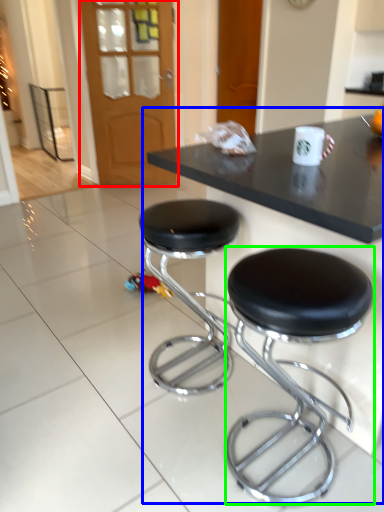
Question: Estimate the real-world distances between objects in this image. Which object is closer to glass door (highlighted by a red box), table (highlighted by a blue box) or stool (highlighted by a green box)?

Choices:
 (A) table
 (B) stool

Answer: (A)